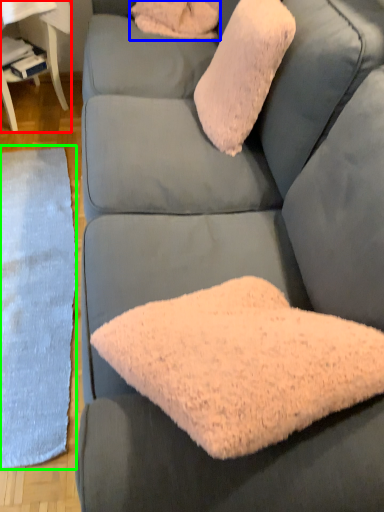
Question: Which object is positioned farthest from table (highlighted by a red box)? Select from pillow (highlighted by a blue box) and mat (highlighted by a green box).

Choices:
 (A) pillow
 (B) mat

Answer: (B)